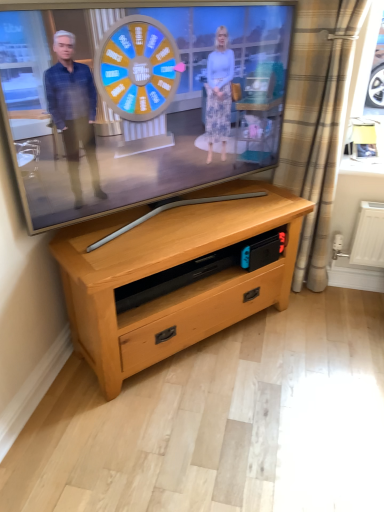
Where is `vacant space underneath matte wooden tv at center (from a real-world perspective)`? Image resolution: width=384 pixels, height=512 pixels. vacant space underneath matte wooden tv at center (from a real-world perspective) is located at coordinates (135, 219).